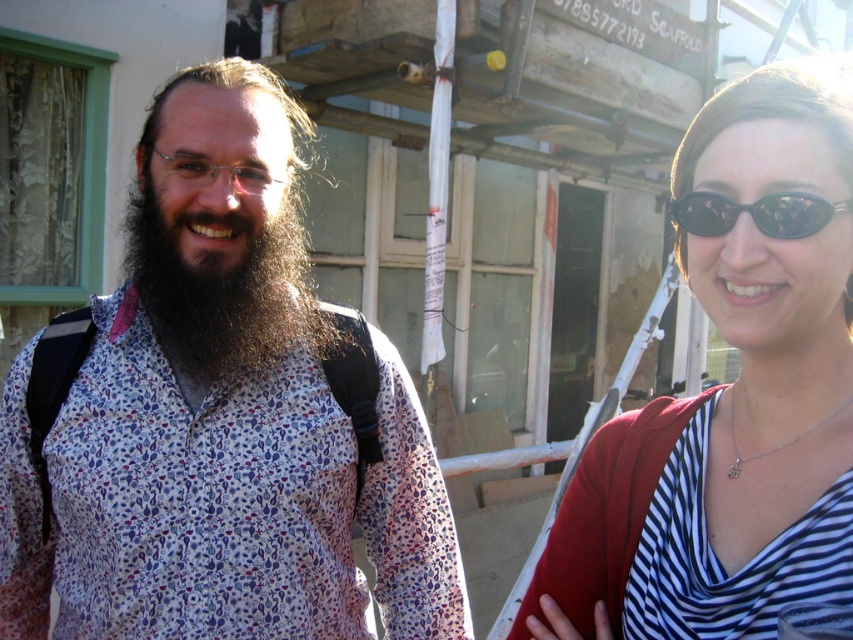
Question: Which object is the farthest from the striped fabric shirt at right?

Choices:
 (A) floral-patterned shirt at left
 (B) brown fuzzy beard at left

Answer: (B)

Question: Does striped fabric shirt at right have a smaller size compared to black plastic sunglasses at upper right?

Choices:
 (A) no
 (B) yes

Answer: (A)

Question: Can you confirm if floral-patterned shirt at left is bigger than brown fuzzy beard at left?

Choices:
 (A) no
 (B) yes

Answer: (B)

Question: Which object appears closest to the camera in this image?

Choices:
 (A) black plastic sunglasses at upper right
 (B) floral-patterned shirt at left

Answer: (A)

Question: Is floral-patterned shirt at left in front of striped fabric shirt at right?

Choices:
 (A) yes
 (B) no

Answer: (B)

Question: Which of the following is the closest to the observer?

Choices:
 (A) (788, 228)
 (B) (328, 404)
 (C) (204, 296)

Answer: (A)